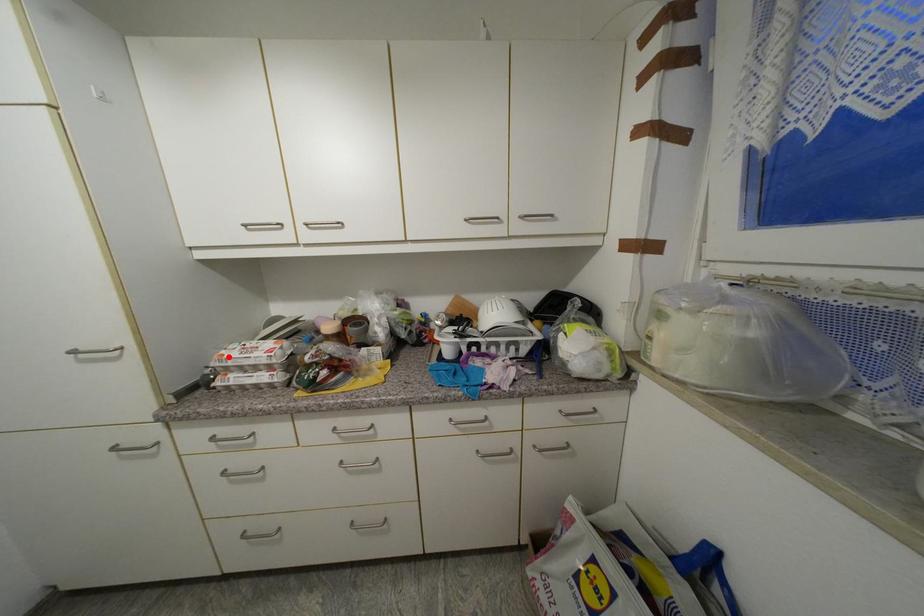
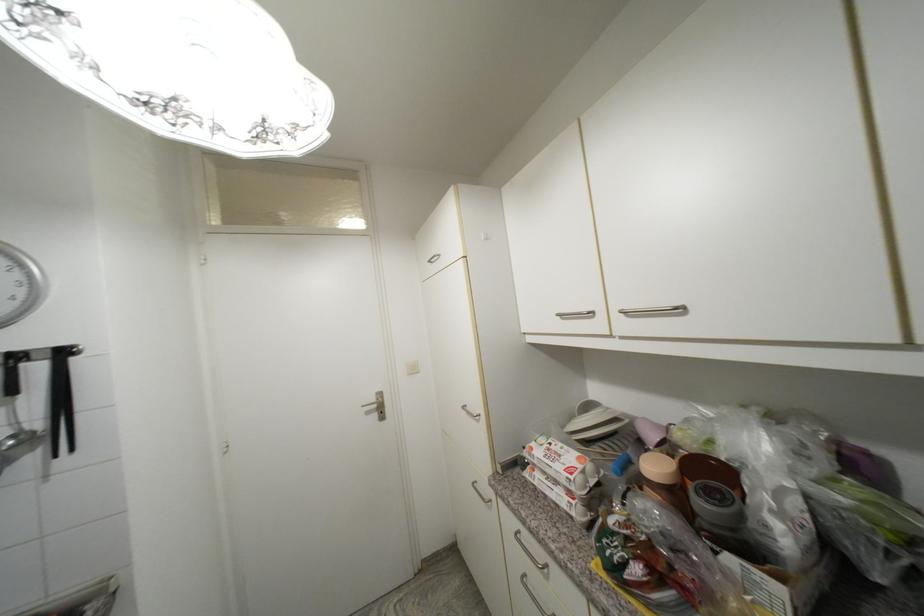
Locate, in the second image, the point that corresponds to the highlighted location in the first image.

(537, 451)